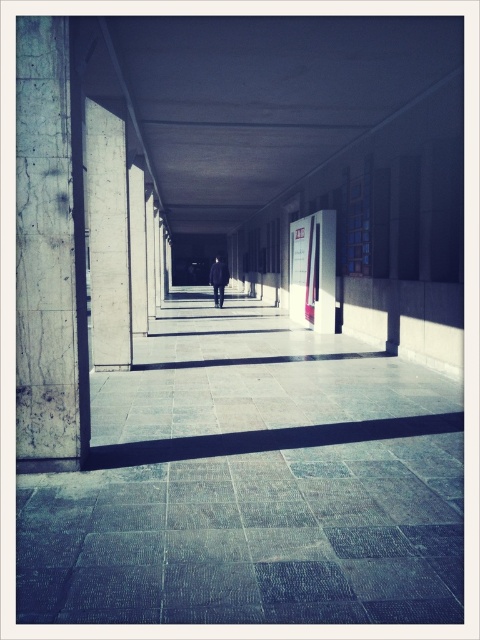
You are standing at the entrance of the corridor and see the marble pillar at left and the dark wool coat at center. Which object is closer to your current position?

The marble pillar at left is closer to your current position because it is to the left of the dark wool coat at center, which is further along the corridor.

You are standing at the entrance of the corridor and notice a marble pillar at left and a dark wool coat at center. Which object takes up more space in the corridor?

The dark wool coat at center takes up more space than the marble pillar at left.

You are standing at the entrance of the corridor and see the marble pillar at left represented by point (49, 252). If you walk straight ahead, will you eventually reach the end of the corridor?

Yes, walking straight ahead from the entrance will lead you to the end of the corridor, as the corridor is long and narrow with a rhythmic pattern of columns leading towards the far end.